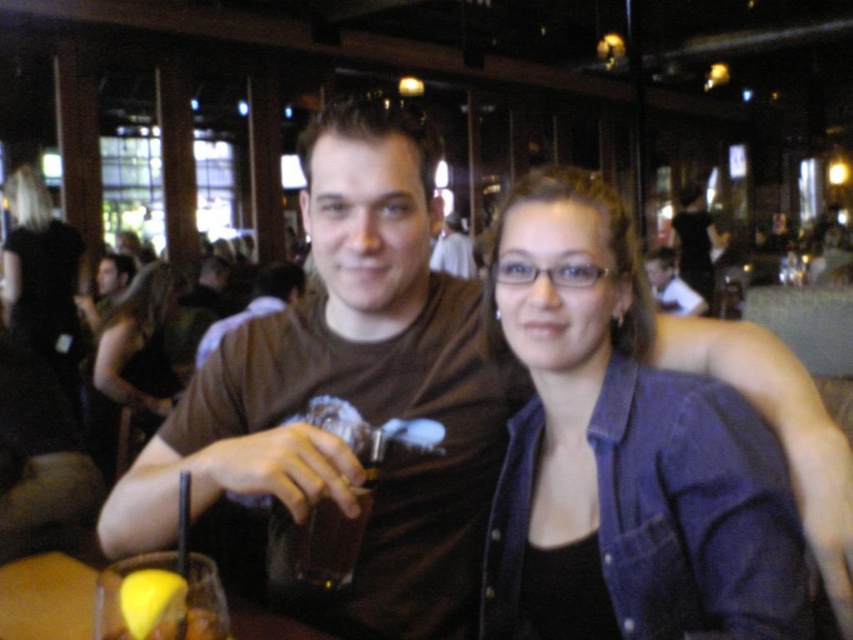
Can you confirm if matte black tank top at center is positioned below matte brown shirt at center?

Correct, matte black tank top at center is located below matte brown shirt at center.

Is matte black tank top at center thinner than matte brown shirt at center?

No.

At what (x,y) coordinates should I click in order to perform the action: click on matte black tank top at center. Please return your answer as a coordinate pair (x, y). Looking at the image, I should click on (138, 344).

Is denim jacket at upper right to the right of translucent plastic cup at lower left from the viewer's perspective?

Correct, you'll find denim jacket at upper right to the right of translucent plastic cup at lower left.

Consider the image. Is denim jacket at upper right further to the viewer compared to translucent plastic cup at lower left?

No.

Locate an element on the screen. The image size is (853, 640). denim jacket at upper right is located at coordinates (624, 452).

Find the location of a particular element. denim jacket at upper right is located at coordinates (624, 452).

Is denim jacket at upper right taller than black denim jacket at upper left?

No, denim jacket at upper right is not taller than black denim jacket at upper left.

Which is more to the left, denim jacket at upper right or black denim jacket at upper left?

black denim jacket at upper left

The height and width of the screenshot is (640, 853). Describe the element at coordinates (624, 452) in the screenshot. I see `denim jacket at upper right` at that location.

You are a GUI agent. You are given a task and a screenshot of the screen. Output one action in this format:
    pyautogui.click(x=<x>, y=<y>)
    Task: Click on the denim jacket at upper right
    
    Given the screenshot: What is the action you would take?
    pyautogui.click(x=624, y=452)